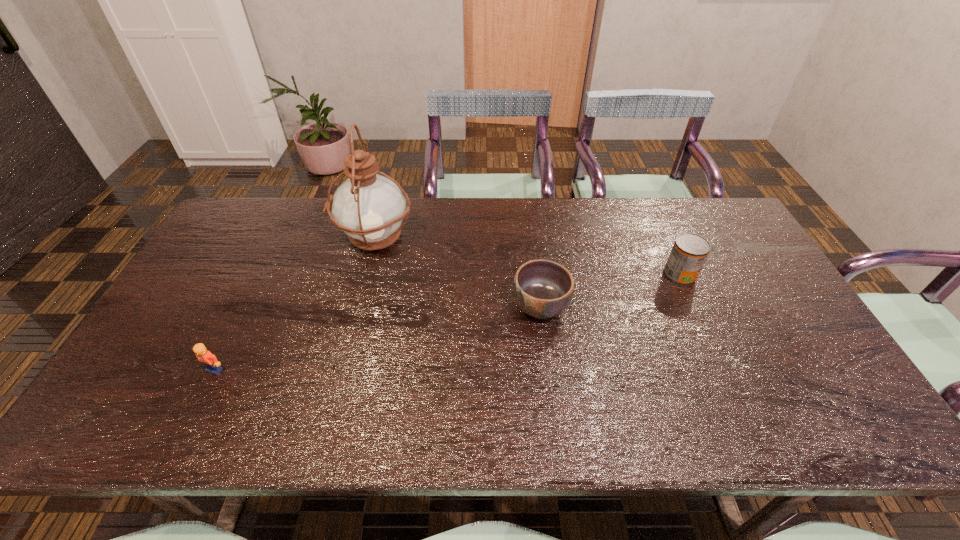
The height and width of the screenshot is (540, 960). In order to click on the third object from right to left in this screenshot , I will do `click(368, 207)`.

The height and width of the screenshot is (540, 960). I want to click on the tallest object, so click(368, 207).

The image size is (960, 540). Identify the location of can. (689, 252).

Image resolution: width=960 pixels, height=540 pixels. I want to click on the second object from right to left, so click(543, 289).

This screenshot has width=960, height=540. Identify the location of the leftmost object. (208, 359).

Find the location of a particular element. the nearest object is located at coordinates click(x=208, y=359).

Where is `free spot located on the left of the second object from left to right`? The width and height of the screenshot is (960, 540). free spot located on the left of the second object from left to right is located at coordinates (264, 238).

Locate an element on the screen. The width and height of the screenshot is (960, 540). vacant space situated 0.050m on the left of the rightmost object is located at coordinates (647, 275).

The height and width of the screenshot is (540, 960). What are the coordinates of `vacant space located on the back of the third object from left to right` in the screenshot? It's located at (527, 206).

Image resolution: width=960 pixels, height=540 pixels. Find the location of `vacant space situated on the front-facing side of the leftmost object`. vacant space situated on the front-facing side of the leftmost object is located at coordinates (189, 422).